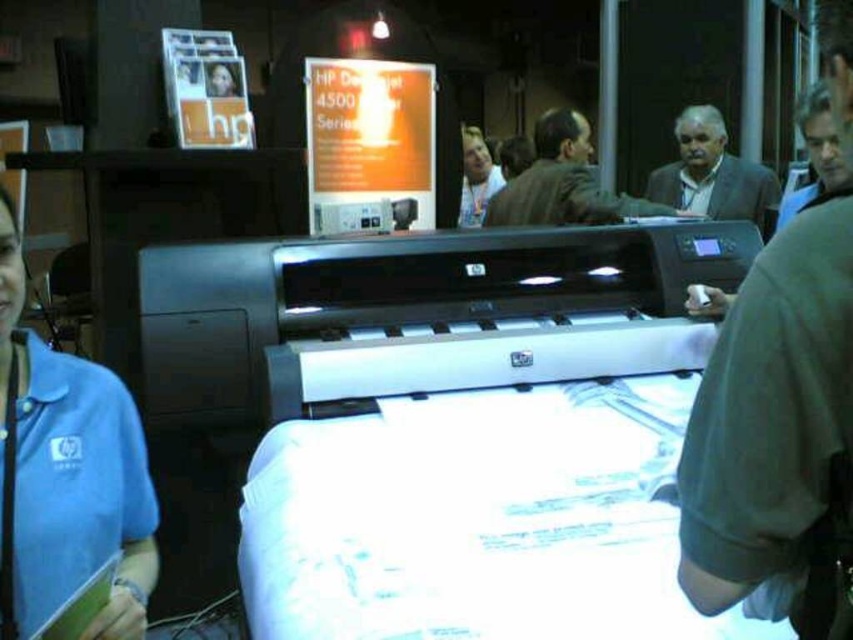
Question: Which point appears closest to the camera in this image?

Choices:
 (A) (485, 188)
 (B) (763, 209)
 (C) (782, 426)

Answer: (C)

Question: Considering the relative positions of dark brown leather jacket at center and matte black shirt at upper center in the image provided, where is dark brown leather jacket at center located with respect to matte black shirt at upper center?

Choices:
 (A) above
 (B) below

Answer: (B)

Question: Observing the image, what is the correct spatial positioning of satin silver printer at center in reference to matte black shirt at upper center?

Choices:
 (A) right
 (B) left

Answer: (B)

Question: Which point is closer to the camera?

Choices:
 (A) dark gray shirt at center
 (B) satin silver printer at center
 (C) matte black shirt at upper center
 (D) gray suit jacket at upper right

Answer: (A)

Question: Which of the following is the farthest from the observer?

Choices:
 (A) (582, 134)
 (B) (837, 497)
 (C) (28, 412)
 (D) (759, 209)

Answer: (D)

Question: From the image, what is the correct spatial relationship of satin silver printer at center in relation to dark gray shirt at center?

Choices:
 (A) above
 (B) below

Answer: (A)